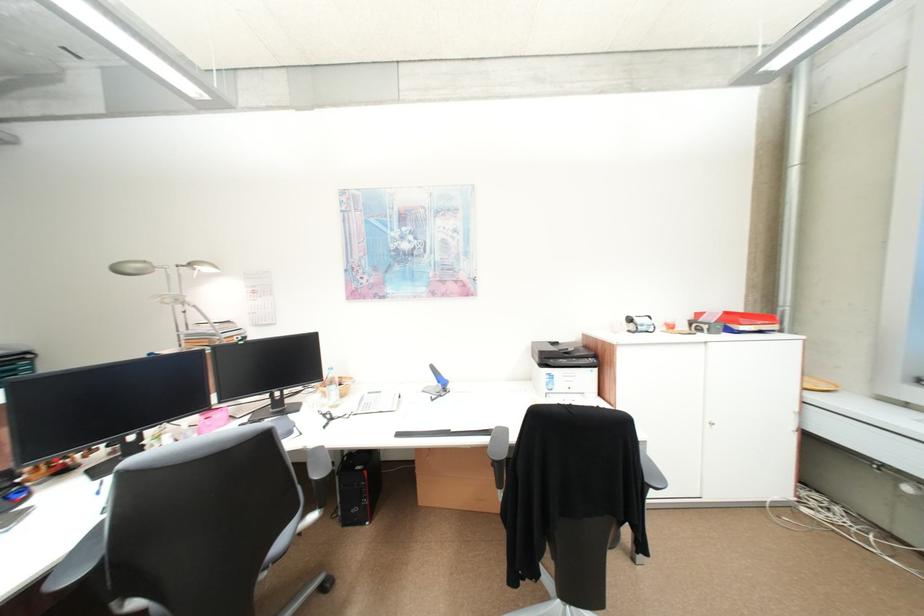
Find where to adjust the silver desk lamp head. Please return your answer as a coordinate pair (x, y).

(131, 268)